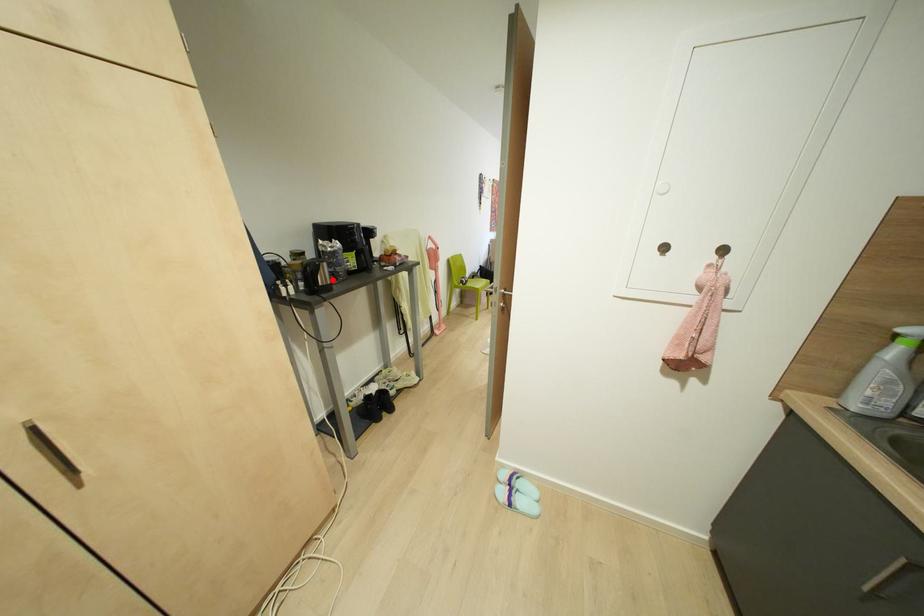
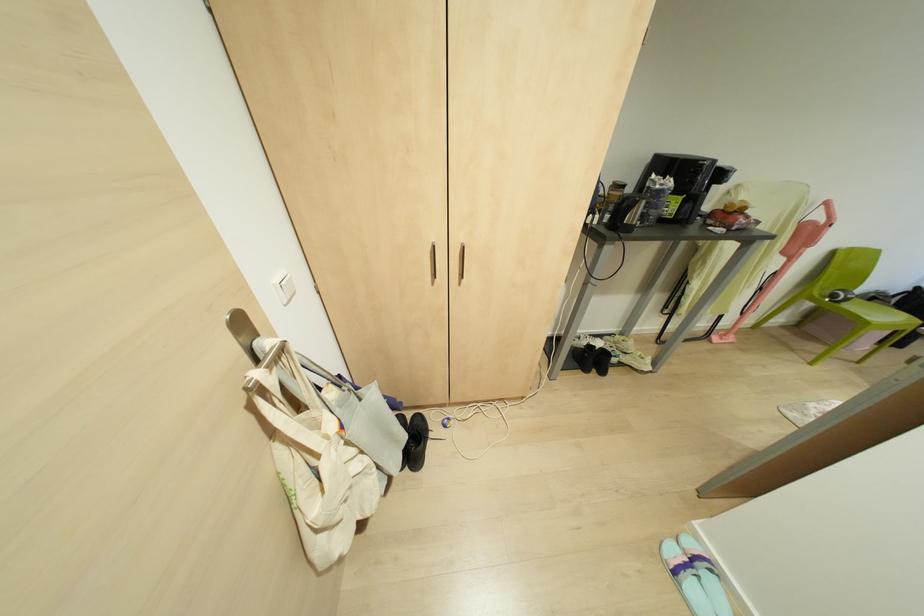
Find the pixel in the second image that matches the highlighted location in the first image.

(637, 223)